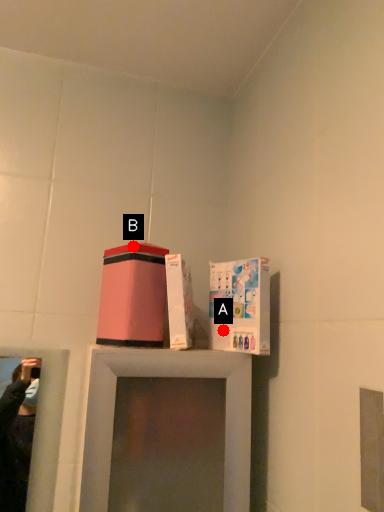
Question: Two points are circled on the image, labeled by A and B beside each circle. Which point is closer to the camera taking this photo?

Choices:
 (A) A is closer
 (B) B is closer

Answer: (B)